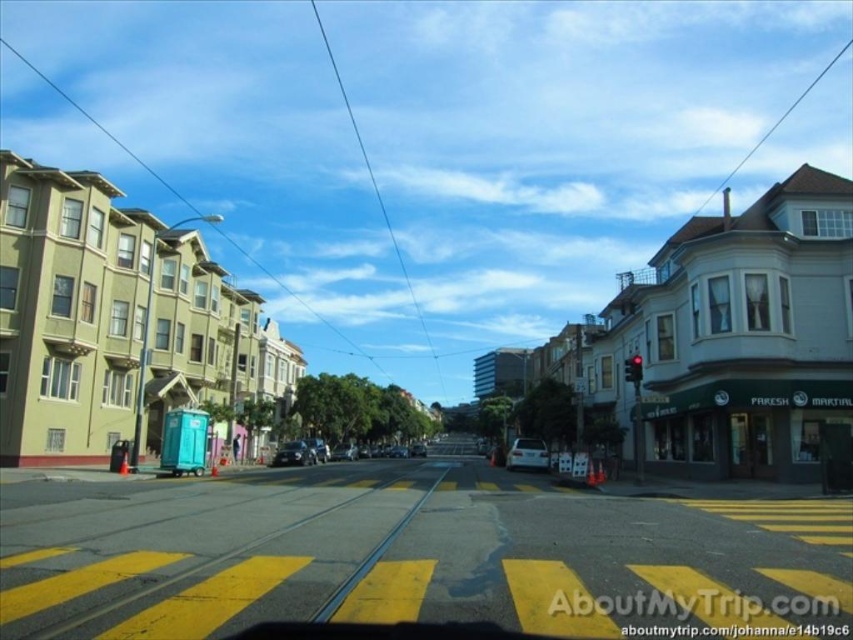
From the picture: How far apart are white matte car at center and shiny silver sedan at center?

A distance of 94.10 meters exists between white matte car at center and shiny silver sedan at center.

Between point (531, 442) and point (296, 452), which one is positioned in front?

Point (531, 442) is more forward.

This screenshot has width=853, height=640. Identify the location of white matte car at center. (527, 454).

Does yellow asphalt at center appear on the right side of white matte car at center?

No, yellow asphalt at center is not to the right of white matte car at center.

Does yellow asphalt at center have a lesser height compared to white matte car at center?

Yes.

At what (x,y) coordinates should I click in order to perform the action: click on yellow asphalt at center. Please return your answer as a coordinate pair (x, y). This screenshot has width=853, height=640. Looking at the image, I should click on (410, 554).

Is point (728, 532) positioned behind point (271, 464)?

No, (728, 532) is closer to viewer.

Who is lower down, yellow asphalt at center or shiny silver sedan at center?

shiny silver sedan at center is below.

This screenshot has width=853, height=640. Describe the element at coordinates (410, 554) in the screenshot. I see `yellow asphalt at center` at that location.

Locate an element on the screen. The image size is (853, 640). yellow asphalt at center is located at coordinates (410, 554).